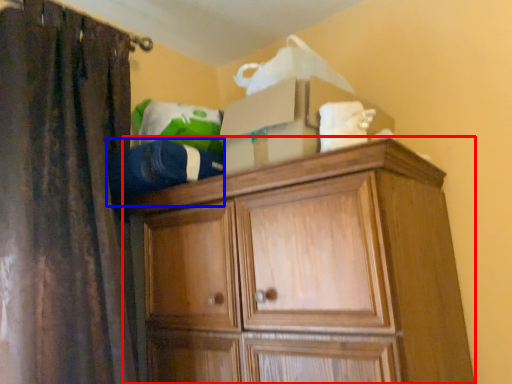
Question: Which of the following is the farthest to the observer, cupboard (highlighted by a red box) or clothing (highlighted by a blue box)?

Choices:
 (A) cupboard
 (B) clothing

Answer: (B)